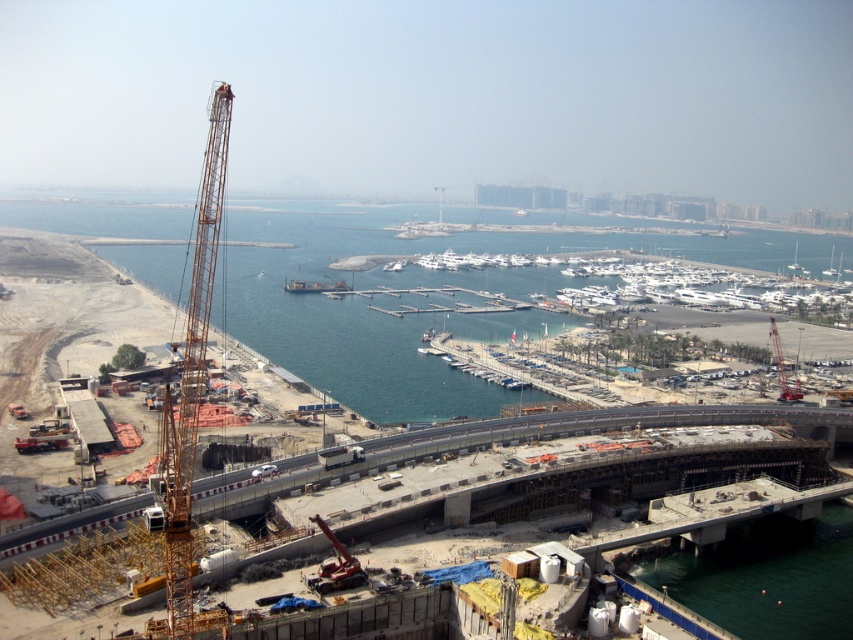
Does orange construction crane at left have a lesser height compared to yellow metallic crane at left?

No, orange construction crane at left is not shorter than yellow metallic crane at left.

Does point (500, 330) come in front of point (181, 397)?

No, (500, 330) is behind (181, 397).

Is point (305, 296) positioned in front of point (195, 333)?

No.

Locate an element on the screen. Image resolution: width=853 pixels, height=640 pixels. orange construction crane at left is located at coordinates (422, 316).